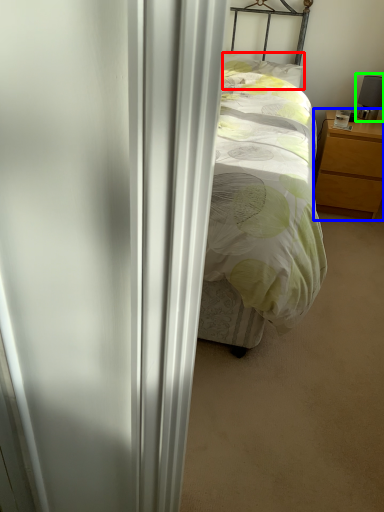
Question: Estimate the real-world distances between objects in this image. Which object is closer to pillow (highlighted by a red box), nightstand (highlighted by a blue box) or table lamp (highlighted by a green box)?

Choices:
 (A) nightstand
 (B) table lamp

Answer: (B)